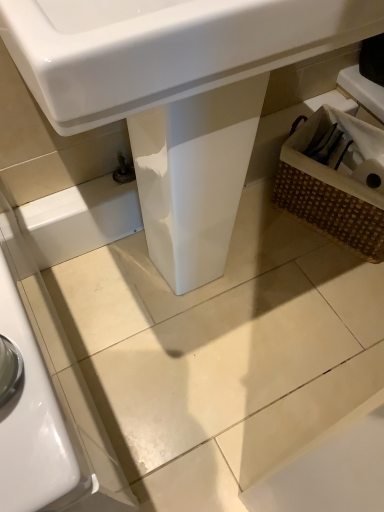
This screenshot has height=512, width=384. Find the location of `white glossy sink at center`. white glossy sink at center is located at coordinates (168, 53).

Describe the element at coordinates (168, 53) in the screenshot. I see `white glossy sink at center` at that location.

Where is `brown woven basket at right`? Image resolution: width=384 pixels, height=512 pixels. brown woven basket at right is located at coordinates 336,180.

This screenshot has height=512, width=384. Describe the element at coordinates (336, 180) in the screenshot. I see `brown woven basket at right` at that location.

Where is `white glossy sink at center`? white glossy sink at center is located at coordinates (168, 53).

Considering the positions of objects white glossy sink at center and brown woven basket at right in the image provided, who is more to the left, white glossy sink at center or brown woven basket at right?

From the viewer's perspective, white glossy sink at center appears more on the left side.

Does white glossy sink at center lie in front of brown woven basket at right?

That is True.

Considering the positions of point (89, 71) and point (316, 138), is point (89, 71) closer or farther from the camera than point (316, 138)?

Point (89, 71) is positioned closer to the camera compared to point (316, 138).

From the image's perspective, between white glossy sink at center and brown woven basket at right, which one is located above?

From the image's view, white glossy sink at center is above.

Consider the image. From a real-world perspective, is white glossy sink at center above or below brown woven basket at right?

In terms of real-world spatial position, white glossy sink at center is above brown woven basket at right.

Is white glossy sink at center thinner than brown woven basket at right?

In fact, white glossy sink at center might be wider than brown woven basket at right.

Who is taller, white glossy sink at center or brown woven basket at right?

Standing taller between the two is white glossy sink at center.

Can you confirm if white glossy sink at center is bigger than brown woven basket at right?

Correct, white glossy sink at center is larger in size than brown woven basket at right.

Is white glossy sink at center outside of brown woven basket at right?

Yes, white glossy sink at center is not within brown woven basket at right.

Based on the photo, are white glossy sink at center and brown woven basket at right located far from each other?

white glossy sink at center is actually quite close to brown woven basket at right.

Is white glossy sink at center aimed at brown woven basket at right?

No, white glossy sink at center is not aimed at brown woven basket at right.

What's the angular difference between white glossy sink at center and brown woven basket at right's facing directions?

65.2 degrees.

How far apart are white glossy sink at center and brown woven basket at right?

white glossy sink at center is 17.49 inches from brown woven basket at right.

Identify the location of basket on the right side of white glossy sink at center. Image resolution: width=384 pixels, height=512 pixels. (336, 180).

Considering the positions of objects brown woven basket at right and white glossy sink at center in the image provided, who is more to the right, brown woven basket at right or white glossy sink at center?

brown woven basket at right.

Is the position of brown woven basket at right less distant than that of white glossy sink at center?

That is False.

Which is less distant, (353, 178) or (204, 21)?

Result: Point (353, 178).

From the image's perspective, which one is positioned higher, brown woven basket at right or white glossy sink at center?

From the image's view, white glossy sink at center is above.

From a real-world perspective, is brown woven basket at right physically located above or below white glossy sink at center?

Clearly, from a real-world perspective, brown woven basket at right is below white glossy sink at center.

Does brown woven basket at right have a greater width compared to white glossy sink at center?

No, brown woven basket at right is not wider than white glossy sink at center.

Who is taller, brown woven basket at right or white glossy sink at center?

white glossy sink at center.

Who is bigger, brown woven basket at right or white glossy sink at center?

With larger size is white glossy sink at center.

Would you say brown woven basket at right is outside white glossy sink at center?

Indeed, brown woven basket at right is completely outside white glossy sink at center.

Are brown woven basket at right and white glossy sink at center far apart?

brown woven basket at right is near white glossy sink at center, not far away.

Is brown woven basket at right aimed at white glossy sink at center?

Yes, brown woven basket at right is turned towards white glossy sink at center.

How many degrees apart are the facing directions of brown woven basket at right and white glossy sink at center?

65.2 degrees separate the facing orientations of brown woven basket at right and white glossy sink at center.

Where is `sink lying on the left of brown woven basket at right`? sink lying on the left of brown woven basket at right is located at coordinates (168, 53).

The height and width of the screenshot is (512, 384). Find the location of `basket behind the white glossy sink at center`. basket behind the white glossy sink at center is located at coordinates (336, 180).

At what (x,y) coordinates should I click in order to perform the action: click on sink above the brown woven basket at right (from a real-world perspective). Please return your answer as a coordinate pair (x, y). Looking at the image, I should click on (168, 53).